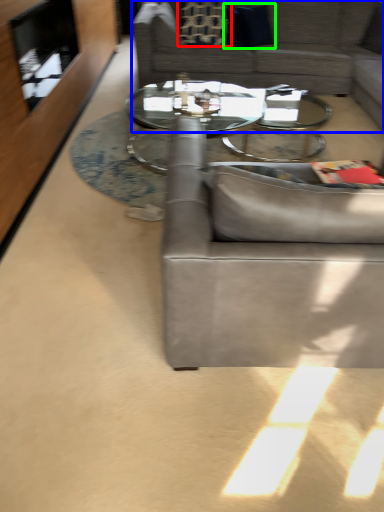
Question: Which object is the farthest from pillow (highlighted by a red box)? Choose among these: studio couch (highlighted by a blue box) or pillow (highlighted by a green box).

Choices:
 (A) studio couch
 (B) pillow

Answer: (A)